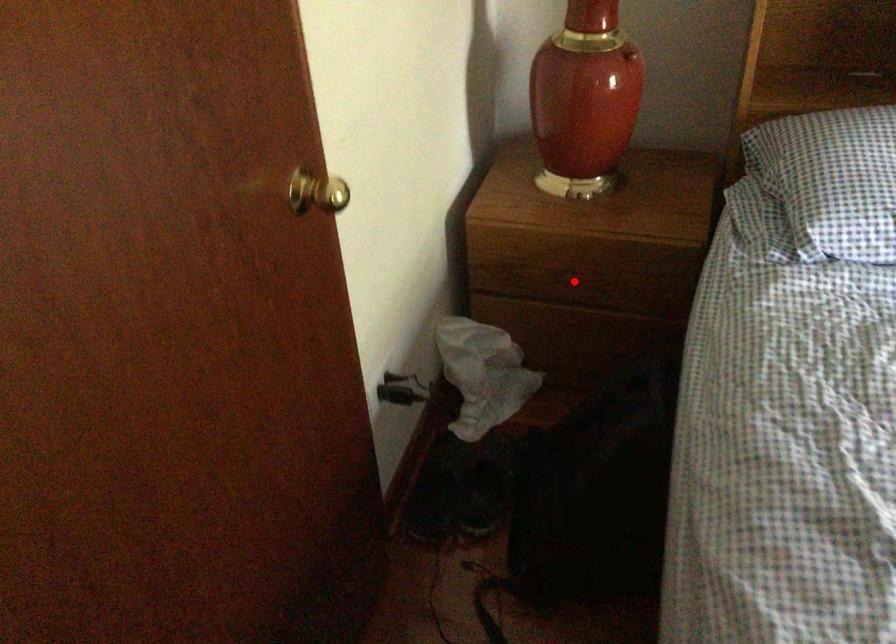
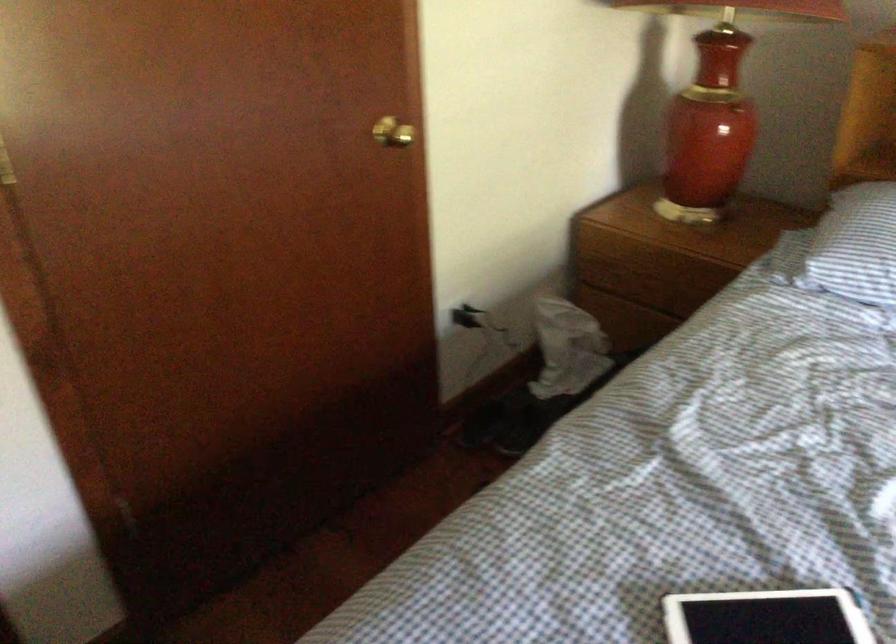
Locate, in the second image, the point that corresponds to the highlighted location in the first image.

(650, 283)